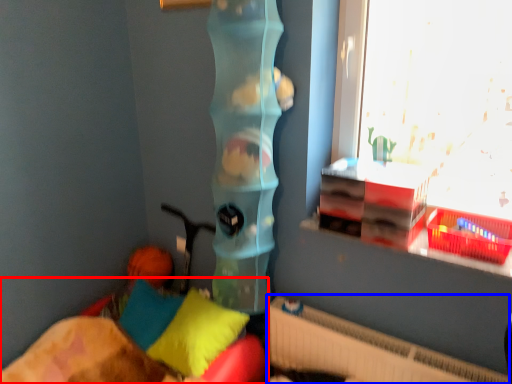
Question: Which point is closer to the camera, furniture (highlighted by a red box) or radiator (highlighted by a blue box)?

Choices:
 (A) furniture
 (B) radiator

Answer: (A)